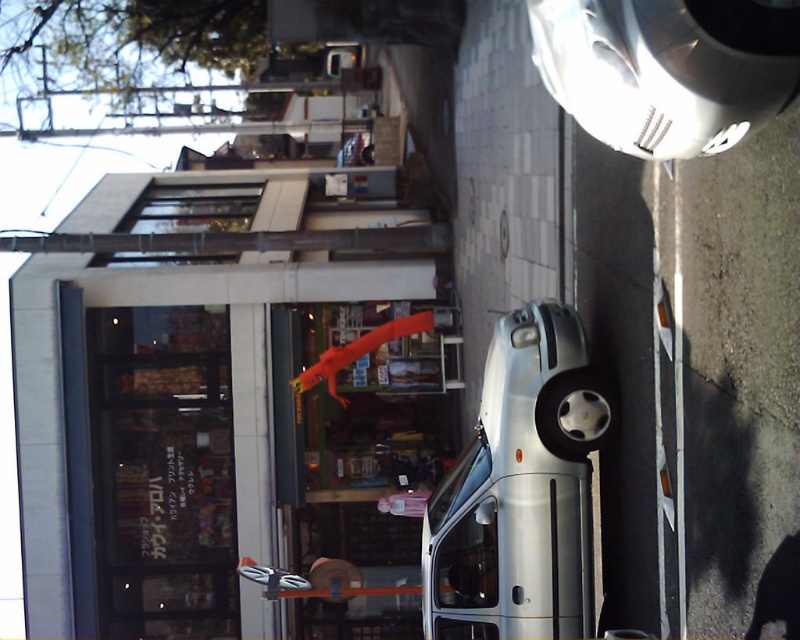
You are a delivery person trying to load a box onto the silver metallic van at center. The box is as tall as the rubber orange lizard at center. Will the box fit inside the van without needing to be tilted?

The silver metallic van at center has a greater height compared to the rubber orange lizard at center. Since the box is as tall as the lizard, it should fit inside the van without tilting.

You are a delivery person trying to park your truck next to the silver metallic van at center and the silver metallic car at upper right. Based on their sizes, which vehicle should you park closer to to ensure enough space for your truck?

The silver metallic van at center is larger in size than the silver metallic car at upper right, so you should park closer to the silver metallic car at upper right to ensure enough space for your truck.

You are standing at the bottom of the rotated image facing upwards. There is a point marked at coordinate (x=520, y=492). What object is located at that point?

The point at coordinate (x=520, y=492) marks the silver metallic van at center.